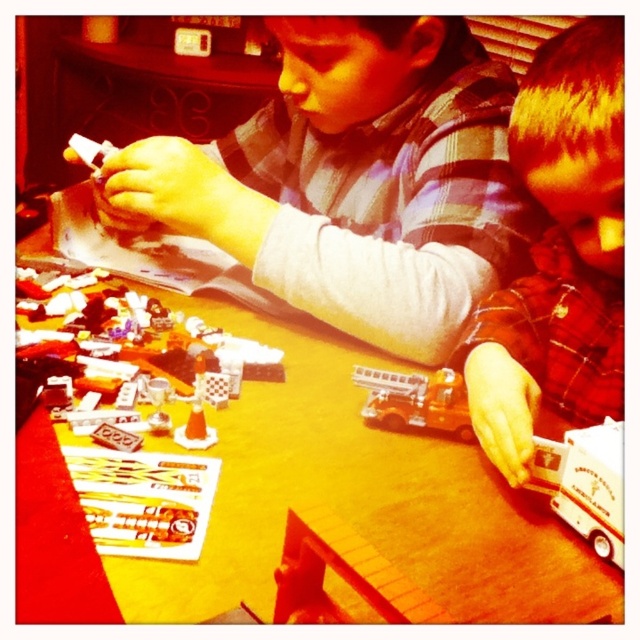
In the scene shown: You are a child who wants to reach the matte plastic toy car at lower right on the table. The table is 24 inches tall. If you are standing on the floor, can you easily reach it without climbing onto the table?

The matte plastic toy car at lower right is 19.95 inches away from viewer. Since the table is 24 inches tall, the toy car is within arm reach from the floor, so yes, you can easily reach it without climbing onto the table.

You are a toy designer who needs to pack both the matte plastic toy car at lower right and the metallic silver firetruck at center into a box. Given that the box has a height limit of 15 cm, can you determine if both items will fit vertically without exceeding the height limit?

The matte plastic toy car at lower right has a greater height compared to the metallic silver firetruck at center. Since the box has a height limit of 15 cm, both items will fit vertically as long as the height of the taller item, the matte plastic toy car at lower right, is less than or equal to 15 cm. However, the exact height measurement is not provided, so we cannot confirm if it meets the limit.

You are a small toy car that is 10 centimeters long. You want to move from the point at the bottom left corner of the table to the point at the bottom right corner of the table. The two points are marked as point (477,573) and point 0.932, 0.123. Can you fit through the space between them?

The distance between point (477,573) and point 0.932, 0.123 is 47.00 centimeters. Since the toy car is only 10 centimeters long, it can easily fit through the space between them.